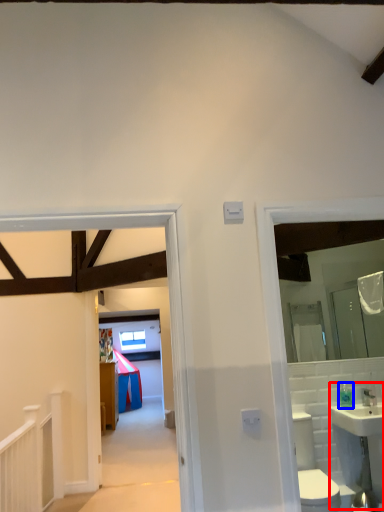
Question: Which of the following is the farthest to the observer, sink (highlighted by a red box) or toiletry (highlighted by a blue box)?

Choices:
 (A) sink
 (B) toiletry

Answer: (B)